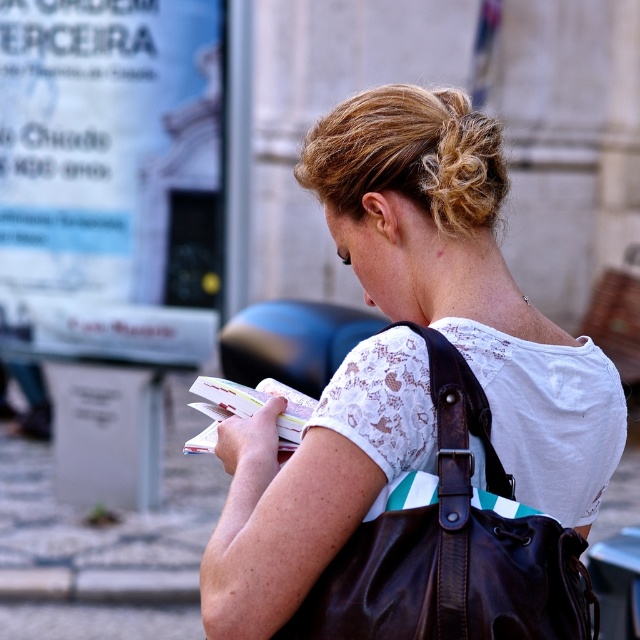
In the scene shown: Does blonde hair at upper center appear on the right side of leather strap at back?

In fact, blonde hair at upper center is to the left of leather strap at back.

Is blonde hair at upper center below leather strap at back?

Actually, blonde hair at upper center is above leather strap at back.

The width and height of the screenshot is (640, 640). Find the location of `blonde hair at upper center`. blonde hair at upper center is located at coordinates (456, 163).

This screenshot has height=640, width=640. Find the location of `brown leather shoulder bag at back`. brown leather shoulder bag at back is located at coordinates (452, 545).

Is point (403, 481) less distant than point (460, 129)?

Yes, point (403, 481) is closer to viewer.

Is point (330, 612) more distant than point (328, 131)?

No.

This screenshot has width=640, height=640. Find the location of `brown leather shoulder bag at back`. brown leather shoulder bag at back is located at coordinates (452, 545).

Is point (342, 520) positioned in front of point (433, 380)?

Yes, it is in front of point (433, 380).

Is white lace shirt at center below brown leather shoulder bag at back?

No, white lace shirt at center is not below brown leather shoulder bag at back.

I want to click on white lace shirt at center, so click(x=465, y=282).